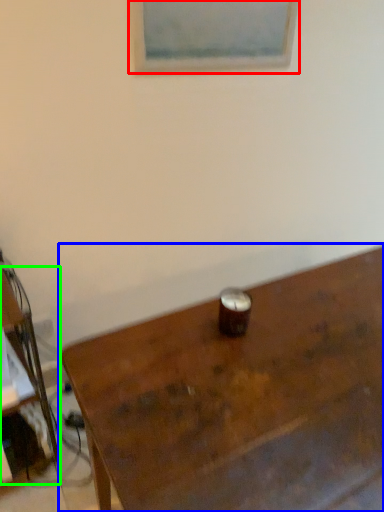
Question: Which is nearer to the picture frame (highlighted by a red box)? table (highlighted by a blue box) or desk (highlighted by a green box).

Choices:
 (A) table
 (B) desk

Answer: (A)